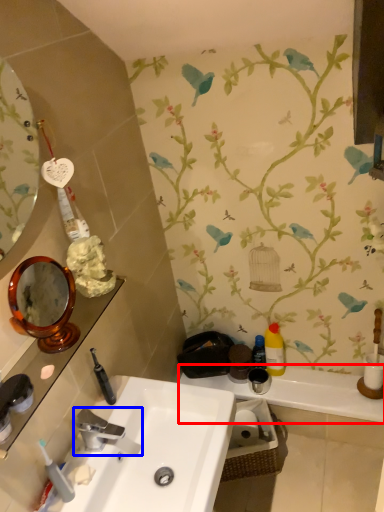
Question: Which object is further to the camera taking this photo, counter top (highlighted by a red box) or tap (highlighted by a blue box)?

Choices:
 (A) counter top
 (B) tap

Answer: (A)